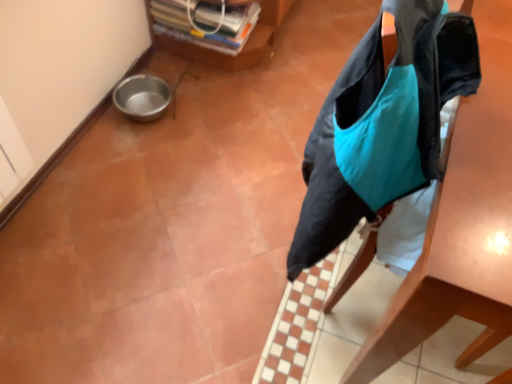
Question: Is plastic transparent container at upper center, the first furniture from the left, positioned with its back to teal fabric bag at right, which is counted as the 2th furniture, starting from the left?

Choices:
 (A) no
 (B) yes

Answer: (A)

Question: Does plastic transparent container at upper center, the first furniture from the left, turn towards teal fabric bag at right, which is the first furniture from right to left?

Choices:
 (A) yes
 (B) no

Answer: (A)

Question: Considering the relative sizes of plastic transparent container at upper center, the first furniture from the left, and teal fabric bag at right, which is counted as the 2th furniture, starting from the left, in the image provided, is plastic transparent container at upper center, the first furniture from the left, thinner than teal fabric bag at right, which is counted as the 2th furniture, starting from the left,?

Choices:
 (A) yes
 (B) no

Answer: (A)

Question: Would you say plastic transparent container at upper center, placed as the second furniture when sorted from right to left, is outside teal fabric bag at right, which is the first furniture from right to left?

Choices:
 (A) no
 (B) yes

Answer: (B)

Question: Is plastic transparent container at upper center, the first furniture from the left, shorter than teal fabric bag at right, which is counted as the 2th furniture, starting from the left?

Choices:
 (A) no
 (B) yes

Answer: (B)

Question: Is plastic transparent container at upper center, placed as the second furniture when sorted from right to left, positioned behind teal fabric bag at right, which is the first furniture from right to left?

Choices:
 (A) yes
 (B) no

Answer: (A)

Question: Could plastic transparent container at upper center, the first furniture from the left, be considered to be inside teal fabric bag at right, which is counted as the 2th furniture, starting from the left?

Choices:
 (A) yes
 (B) no

Answer: (B)

Question: From the image's perspective, would you say teal fabric bag at right, which is counted as the 2th furniture, starting from the left, is positioned over plastic transparent container at upper center, the first furniture from the left?

Choices:
 (A) no
 (B) yes

Answer: (A)

Question: Considering the relative sizes of teal fabric bag at right, which is counted as the 2th furniture, starting from the left, and plastic transparent container at upper center, the first furniture from the left, in the image provided, is teal fabric bag at right, which is counted as the 2th furniture, starting from the left, taller than plastic transparent container at upper center, the first furniture from the left,?

Choices:
 (A) yes
 (B) no

Answer: (A)

Question: From a real-world perspective, is teal fabric bag at right, which is the first furniture from right to left, below plastic transparent container at upper center, placed as the second furniture when sorted from right to left?

Choices:
 (A) no
 (B) yes

Answer: (A)

Question: From a real-world perspective, does teal fabric bag at right, which is the first furniture from right to left, stand above plastic transparent container at upper center, placed as the second furniture when sorted from right to left?

Choices:
 (A) yes
 (B) no

Answer: (A)

Question: Considering the relative sizes of teal fabric bag at right, which is counted as the 2th furniture, starting from the left, and plastic transparent container at upper center, the first furniture from the left, in the image provided, is teal fabric bag at right, which is counted as the 2th furniture, starting from the left, smaller than plastic transparent container at upper center, the first furniture from the left,?

Choices:
 (A) yes
 (B) no

Answer: (B)

Question: From a real-world perspective, is plastic transparent container at upper center, placed as the second furniture when sorted from right to left, above or below teal fabric bag at right, which is counted as the 2th furniture, starting from the left?

Choices:
 (A) above
 (B) below

Answer: (B)